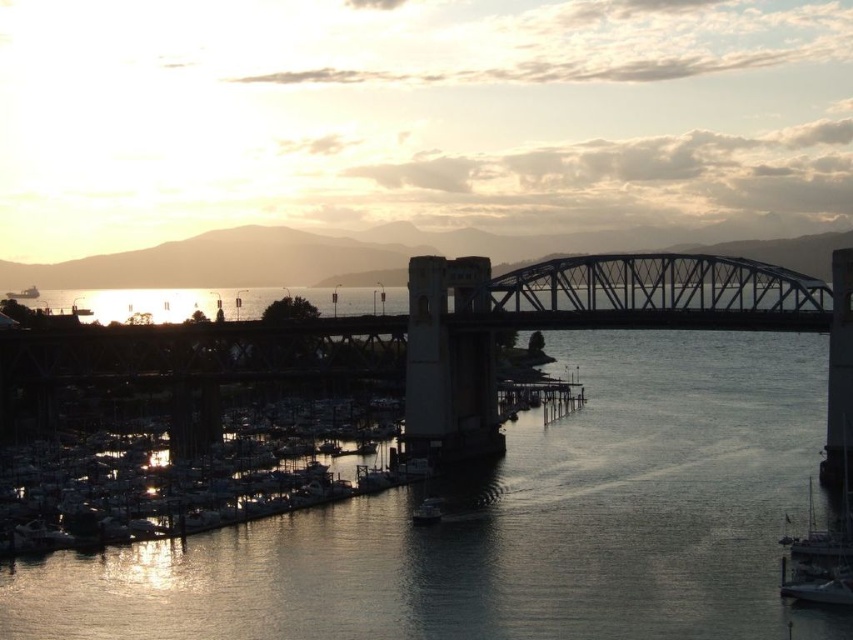
Who is positioned more to the right, dark gray concrete waterway at center or white matte boats at lower left?

Positioned to the right is dark gray concrete waterway at center.

Locate an element on the screen. This screenshot has height=640, width=853. dark gray concrete waterway at center is located at coordinates (509, 524).

Find the location of a particular element. The height and width of the screenshot is (640, 853). dark gray concrete waterway at center is located at coordinates (509, 524).

Can you confirm if dark gray concrete waterway at center is bigger than metallic silver boat at center?

Correct, dark gray concrete waterway at center is larger in size than metallic silver boat at center.

Consider the image. Can you confirm if dark gray concrete waterway at center is thinner than metallic silver boat at center?

Incorrect, dark gray concrete waterway at center's width is not less than metallic silver boat at center's.

Between point (564, 481) and point (427, 513), which one is positioned in front?

Positioned in front is point (427, 513).

Find the location of `dark gray concrete waterway at center`. dark gray concrete waterway at center is located at coordinates (509, 524).

Is point (637, 620) behind point (22, 292)?

No.

Which is in front, point (698, 365) or point (33, 284)?

Point (698, 365)

The image size is (853, 640). In order to click on dark gray concrete waterway at center in this screenshot , I will do `click(509, 524)`.

Locate an element on the screen. This screenshot has height=640, width=853. dark gray concrete waterway at center is located at coordinates (509, 524).